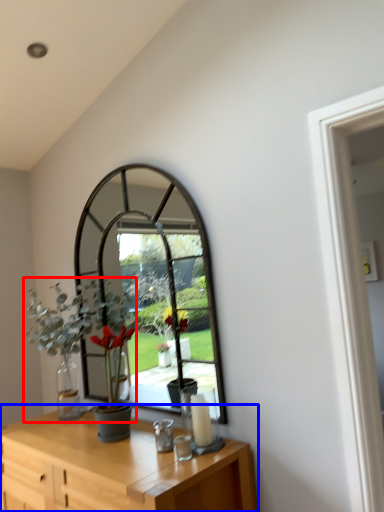
Question: Among these objects, which one is nearest to the camera, houseplant (highlighted by a red box) or table (highlighted by a blue box)?

Choices:
 (A) houseplant
 (B) table

Answer: (B)